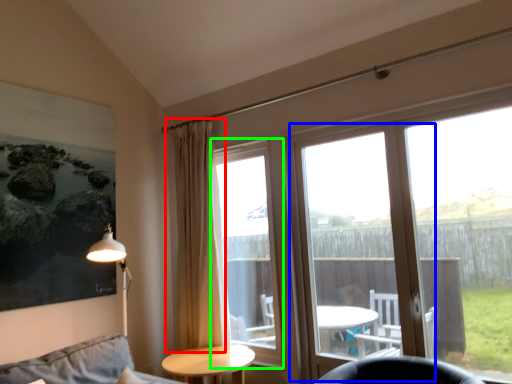
Question: Which is farther away from curtain (highlighted by a red box)? screen door (highlighted by a blue box) or bay window (highlighted by a green box)?

Choices:
 (A) screen door
 (B) bay window

Answer: (A)